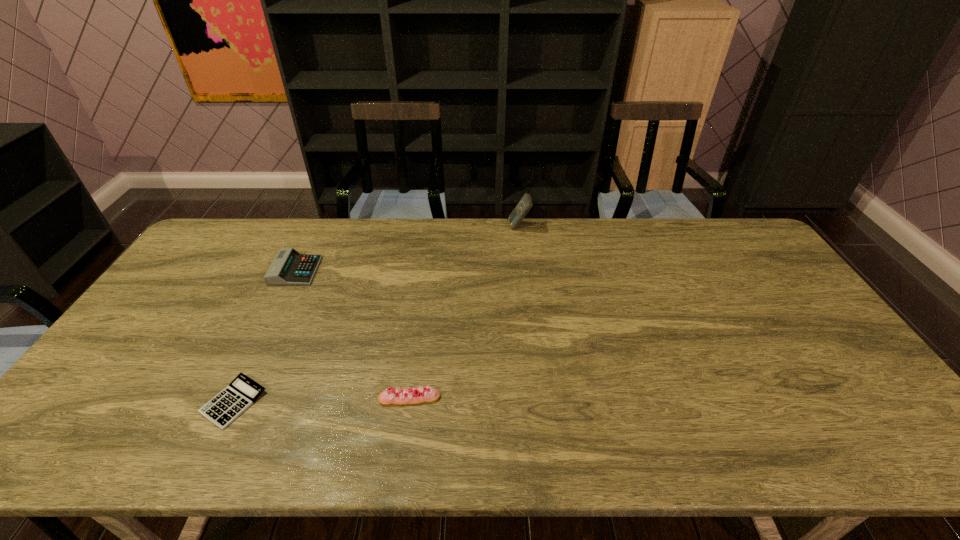
Locate an element on the screen. object that ranks as the second closest to the farthest calculator is located at coordinates (404, 396).

Where is `calculator that is the closest to the second nearest calculator`? calculator that is the closest to the second nearest calculator is located at coordinates (242, 392).

Identify which calculator is located as the nearest to the shortest calculator. Please provide its 2D coordinates. Your answer should be formatted as a tuple, i.e. [(x, y)], where the tuple contains the x and y coordinates of a point satisfying the conditions above.

[(289, 267)]

Where is `vacant space that satisfies the following two spatial constraints: 1. on the front-facing side of the tallest calculator; 2. on the front side of the second object from right to left`? The width and height of the screenshot is (960, 540). vacant space that satisfies the following two spatial constraints: 1. on the front-facing side of the tallest calculator; 2. on the front side of the second object from right to left is located at coordinates (540, 398).

This screenshot has height=540, width=960. Identify the location of free spot that satisfies the following two spatial constraints: 1. on the front-facing side of the tallest calculator; 2. on the front side of the second shortest calculator. click(x=524, y=271).